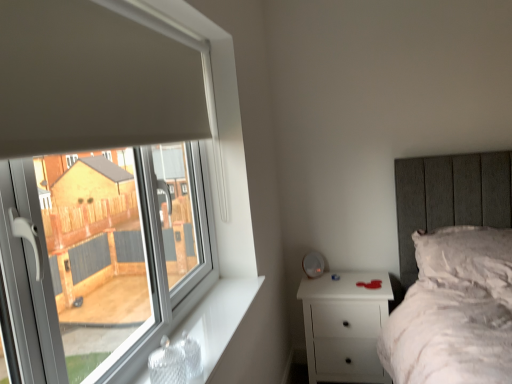
Identify the location of white fluffy pillow at upper right. The height and width of the screenshot is (384, 512). (468, 257).

The width and height of the screenshot is (512, 384). What do you see at coordinates (468, 257) in the screenshot? I see `white fluffy pillow at upper right` at bounding box center [468, 257].

The width and height of the screenshot is (512, 384). What are the coordinates of `white plastic window at left` in the screenshot? It's located at (103, 183).

Considering the sizes of white glossy window sill at lower left and white fluffy pillow at upper right in the image, is white glossy window sill at lower left bigger or smaller than white fluffy pillow at upper right?

In the image, white glossy window sill at lower left appears to be smaller than white fluffy pillow at upper right.

Consider the image. From the image's perspective, is white glossy window sill at lower left located beneath white fluffy pillow at upper right?

Correct, white glossy window sill at lower left appears lower than white fluffy pillow at upper right in the image.

Where is `pillow below the white glossy window sill at lower left (from a real-world perspective)`? The image size is (512, 384). pillow below the white glossy window sill at lower left (from a real-world perspective) is located at coordinates (468, 257).

Is white glossy window sill at lower left next to white fluffy pillow at upper right and touching it?

white glossy window sill at lower left is not next to white fluffy pillow at upper right, and they're not touching.

Which of these two, white matte nightstand at lower right or white fluffy pillow at upper right, is bigger?

white matte nightstand at lower right is bigger.

Is white matte nightstand at lower right wider than white fluffy pillow at upper right?

In fact, white matte nightstand at lower right might be narrower than white fluffy pillow at upper right.

Who is taller, white matte nightstand at lower right or white fluffy pillow at upper right?

With more height is white matte nightstand at lower right.

Is white matte nightstand at lower right to the right of white fluffy pillow at upper right from the viewer's perspective?

No, white matte nightstand at lower right is not to the right of white fluffy pillow at upper right.

Is white plastic window at left to the left of white matte nightstand at lower right from the viewer's perspective?

Yes, white plastic window at left is to the left of white matte nightstand at lower right.

The height and width of the screenshot is (384, 512). Identify the location of window located above the white matte nightstand at lower right (from a real-world perspective). (103, 183).

Considering the sizes of objects white fluffy pillow at upper right and white plastic window at left in the image provided, who is taller, white fluffy pillow at upper right or white plastic window at left?

With more height is white plastic window at left.

From a real-world perspective, is white fluffy pillow at upper right beneath white plastic window at left?

Yes, from a real-world perspective, white fluffy pillow at upper right is beneath white plastic window at left.

You are a GUI agent. You are given a task and a screenshot of the screen. Output one action in this format:
    pyautogui.click(x=<x>, y=<y>)
    Task: Click on the window on the left of white fluffy pillow at upper right
    The height and width of the screenshot is (384, 512).
    Given the screenshot: What is the action you would take?
    pyautogui.click(x=103, y=183)

Is white matte nightstand at lower right thinner than white glossy window sill at lower left?

No.

Considering the positions of objects white matte nightstand at lower right and white glossy window sill at lower left in the image provided, who is more to the right, white matte nightstand at lower right or white glossy window sill at lower left?

white matte nightstand at lower right is more to the right.

Considering the sizes of objects white matte nightstand at lower right and white glossy window sill at lower left in the image provided, who is shorter, white matte nightstand at lower right or white glossy window sill at lower left?

white glossy window sill at lower left is shorter.

Is white glossy window sill at lower left at the back of white matte nightstand at lower right?

That's not correct — white matte nightstand at lower right is not looking away from white glossy window sill at lower left.

Between point (489, 243) and point (237, 286), which one is positioned behind?

The point (489, 243) is farther from the camera.

You are a GUI agent. You are given a task and a screenshot of the screen. Output one action in this format:
    pyautogui.click(x=<x>, y=<y>)
    Task: Click on the pillow behind the white glossy window sill at lower left
    This screenshot has width=512, height=384.
    Given the screenshot: What is the action you would take?
    pyautogui.click(x=468, y=257)

Measure the distance between white fluffy pillow at upper right and white glossy window sill at lower left.

white fluffy pillow at upper right and white glossy window sill at lower left are 1.14 meters apart.

Is white fluffy pillow at upper right at the left side of white glossy window sill at lower left?

No, white fluffy pillow at upper right is not to the left of white glossy window sill at lower left.

Considering the sizes of objects white plastic window at left and white glossy window sill at lower left in the image provided, who is thinner, white plastic window at left or white glossy window sill at lower left?

white plastic window at left.

From the picture: Which object is positioned more to the right, white plastic window at left or white glossy window sill at lower left?

From the viewer's perspective, white glossy window sill at lower left appears more on the right side.

In the scene shown: Would you consider white plastic window at left to be distant from white glossy window sill at lower left?

white plastic window at left is near white glossy window sill at lower left, not far away.

Who is smaller, white plastic window at left or white glossy window sill at lower left?

A: With smaller size is white glossy window sill at lower left.

You are a GUI agent. You are given a task and a screenshot of the screen. Output one action in this format:
    pyautogui.click(x=<x>, y=<y>)
    Task: Click on the window sill above the white fluffy pillow at upper right (from a real-world perspective)
    
    Given the screenshot: What is the action you would take?
    (x=218, y=319)

Where is `pillow above the white matte nightstand at lower right (from the image's perspective)`? pillow above the white matte nightstand at lower right (from the image's perspective) is located at coordinates (468, 257).

Considering their positions, is white plastic window at left positioned further to white glossy window sill at lower left than white matte nightstand at lower right?

white matte nightstand at lower right is positioned further to the anchor white glossy window sill at lower left.

When comparing their distances from white fluffy pillow at upper right, does white matte nightstand at lower right or white glossy window sill at lower left seem further?

white glossy window sill at lower left lies further to white fluffy pillow at upper right than the other object.

Considering their positions, is white matte nightstand at lower right positioned further to white glossy window sill at lower left than white plastic window at left?

white matte nightstand at lower right lies further to white glossy window sill at lower left than the other object.

From the picture: From the image, which object appears to be farther from white glossy window sill at lower left, white fluffy pillow at upper right or white matte nightstand at lower right?

white fluffy pillow at upper right lies further to white glossy window sill at lower left than the other object.

Looking at the image, which one is located further to white glossy window sill at lower left, white matte nightstand at lower right or white fluffy pillow at upper right?

white fluffy pillow at upper right is further to white glossy window sill at lower left.

From the picture: Looking at the image, which one is located closer to white fluffy pillow at upper right, white plastic window at left or white matte nightstand at lower right?

The object closer to white fluffy pillow at upper right is white matte nightstand at lower right.

From the picture: Considering their positions, is white plastic window at left positioned closer to white fluffy pillow at upper right than white glossy window sill at lower left?

white glossy window sill at lower left.

In the scene shown: When comparing their distances from white matte nightstand at lower right, does white fluffy pillow at upper right or white plastic window at left seem further?

Among the two, white plastic window at left is located further to white matte nightstand at lower right.

Where is `nightstand between white glossy window sill at lower left and white fluffy pillow at upper right`? The width and height of the screenshot is (512, 384). nightstand between white glossy window sill at lower left and white fluffy pillow at upper right is located at coordinates tap(345, 325).

Image resolution: width=512 pixels, height=384 pixels. I want to click on pillow positioned between white plastic window at left and white matte nightstand at lower right from near to far, so click(468, 257).

Image resolution: width=512 pixels, height=384 pixels. I want to click on window sill between white plastic window at left and white fluffy pillow at upper right in the horizontal direction, so click(x=218, y=319).

Locate an element on the screen. The width and height of the screenshot is (512, 384). window sill between white plastic window at left and white matte nightstand at lower right along the z-axis is located at coordinates (218, 319).